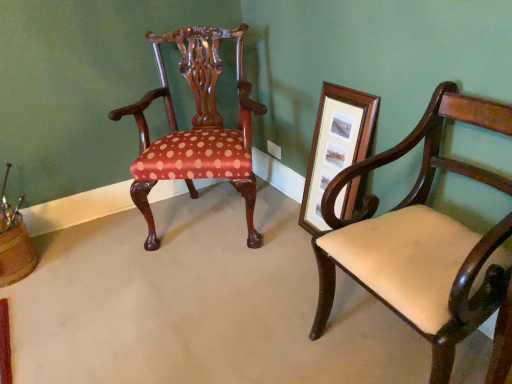
Find the location of `space that is in front of polished wood chair at center, arranged as the second chair when viewed from the front`. space that is in front of polished wood chair at center, arranged as the second chair when viewed from the front is located at coordinates (196, 291).